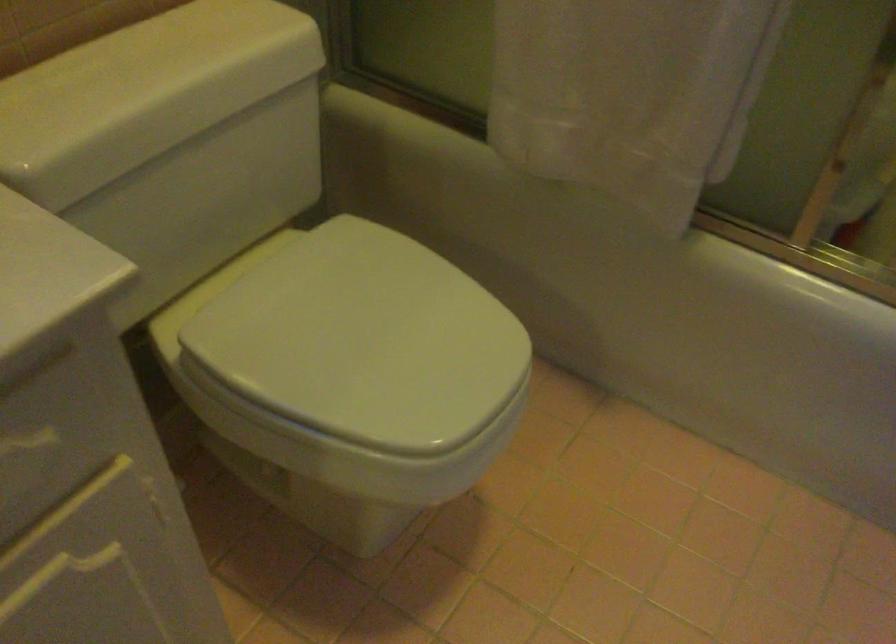
Locate an element on the screen. This screenshot has width=896, height=644. white toilet lid is located at coordinates (365, 341).